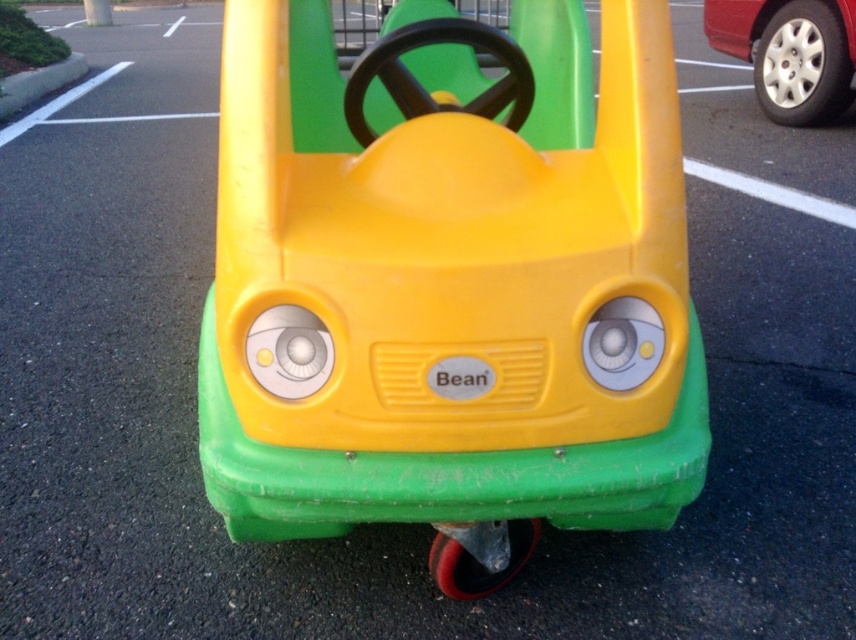
You are a child who wants to reach the metallic silver wheel at upper right from the yellow plastic toy car at center. Can you walk directly to it without any obstacles?

The yellow plastic toy car at center and metallic silver wheel at upper right are 4.38 meters apart from each other. Since the paved surface is likely a parking lot with white parking lines, there are no mentioned obstacles between them, so you can walk directly to the metallic silver wheel at upper right.

You are standing at the position of the red vehicle in the upper right. You see two points marked in the image, point (x=669, y=182) and point (x=801, y=61). Which point is closer to you?

Point (x=669, y=182) is in front of point (x=801, y=61), so the point closer to you is point (x=669, y=182).